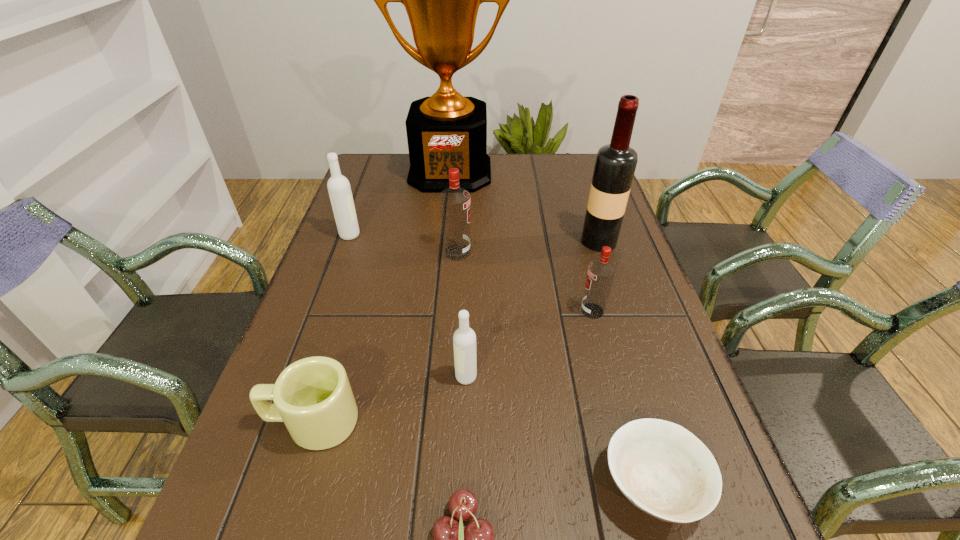
Locate an element on the screen. The height and width of the screenshot is (540, 960). the right white vodka is located at coordinates (464, 339).

Identify the location of the seventh tallest object. (312, 396).

Where is `beige mug`? This screenshot has height=540, width=960. beige mug is located at coordinates (312, 396).

Identify the location of vacant space located on the front of the tallest object with the label. This screenshot has width=960, height=540. [x=446, y=207].

Identify the location of free spot located on the back of the wine bottle. This screenshot has height=540, width=960. (576, 171).

Locate an element on the screen. The height and width of the screenshot is (540, 960). free space located 0.070m on the right of the farthest vodka is located at coordinates (386, 235).

I want to click on free space located on the front label of the farther red vodka, so click(x=574, y=252).

At what (x,y) coordinates should I click in order to perform the action: click on free space located 0.140m on the front label of the second nearest vodka. Please return your answer as a coordinate pair (x, y). Looking at the image, I should click on (518, 310).

Find the location of a particular element. The image size is (960, 540). vacant space located on the front label of the second nearest vodka is located at coordinates (532, 310).

At what (x,y) coordinates should I click in order to perform the action: click on vacant space located on the front label of the second nearest vodka. Please return your answer as a coordinate pair (x, y). This screenshot has width=960, height=540. Looking at the image, I should click on (518, 310).